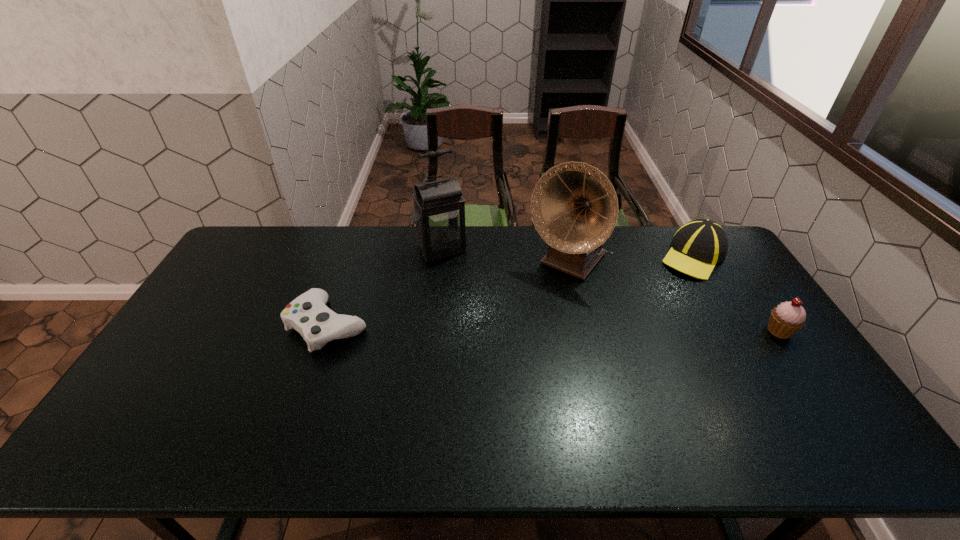
You are a GUI agent. You are given a task and a screenshot of the screen. Output one action in this format:
    pyautogui.click(x=<x>, y=<y>)
    Task: Click on the control
    
    Given the screenshot: What is the action you would take?
    pyautogui.click(x=308, y=314)

The image size is (960, 540). Find the location of `the shortest object`. the shortest object is located at coordinates (308, 314).

What are the coordinates of `cupcake` in the screenshot? It's located at (786, 319).

At what (x,y) coordinates should I click in order to perform the action: click on the second object from left to right. Please return your answer as a coordinate pair (x, y). This screenshot has width=960, height=540. Looking at the image, I should click on (439, 209).

Identify the location of baseball cap. (699, 245).

This screenshot has width=960, height=540. What are the coordinates of `the third object from right to left` in the screenshot? It's located at (574, 207).

Where is `blank area located on the right of the shortest object`? blank area located on the right of the shortest object is located at coordinates (405, 325).

I want to click on vacant position located 0.310m on the left of the cupcake, so click(660, 331).

I want to click on vacant space positioned 0.170m on the front-facing side of the lantern, so click(x=468, y=293).

In order to click on free space located on the front-facing side of the lantern in this screenshot , I will do `click(476, 307)`.